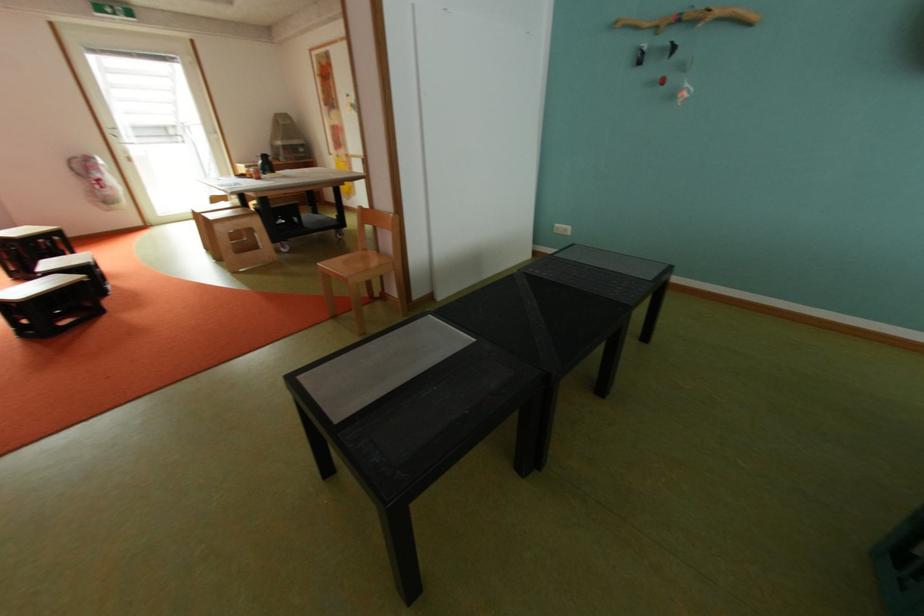
Image resolution: width=924 pixels, height=616 pixels. What do you see at coordinates (562, 229) in the screenshot? I see `a white power outlet` at bounding box center [562, 229].